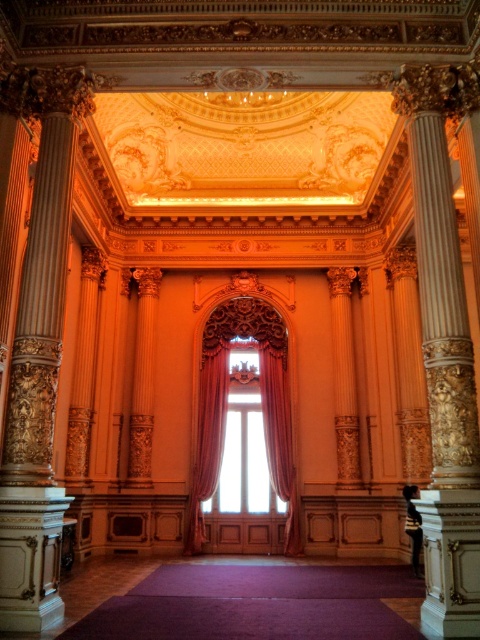
Which is in front, point (201, 496) or point (267, 404)?

Positioned in front is point (201, 496).

Does velvet pink curtain at center have a lesser width compared to velvet curtain at center?

Incorrect, velvet pink curtain at center's width is not less than velvet curtain at center's.

I want to click on velvet pink curtain at center, so click(207, 438).

Where is `velvet pink curtain at center`? The image size is (480, 640). velvet pink curtain at center is located at coordinates (207, 438).